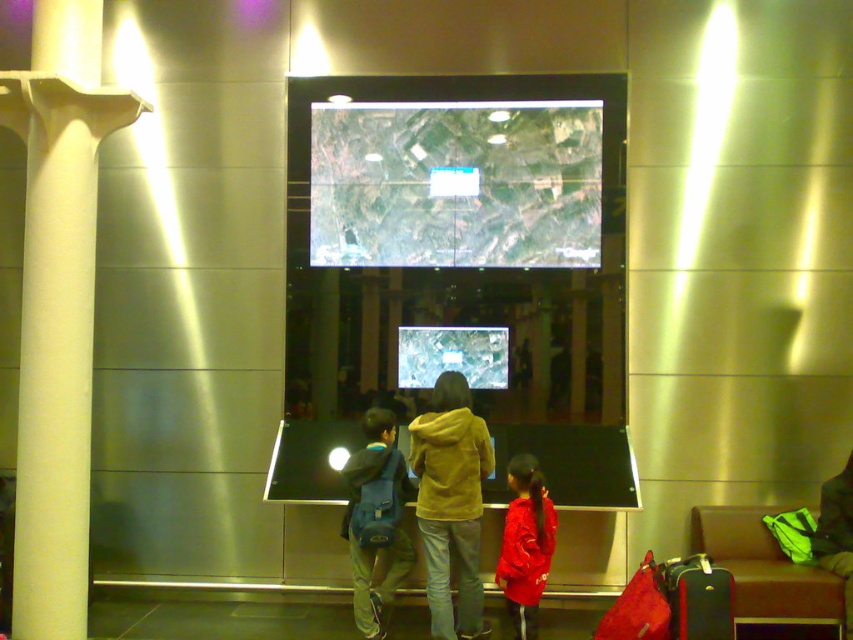
You are a security guard checking the width of objects in the room. You see the yellow fleece jacket at center and the matte red suitcase at lower right. Which object has a greater width?

The yellow fleece jacket at center has a greater width than the matte red suitcase at lower right.

You are standing in front of the large interactive display and want to move to the red fleece jacket at lower right without touching the white smooth column at left. Which direction should you move first?

Since the white smooth column at left is to the left of the red fleece jacket at lower right, you should move to the right to avoid the column and reach the jacket.